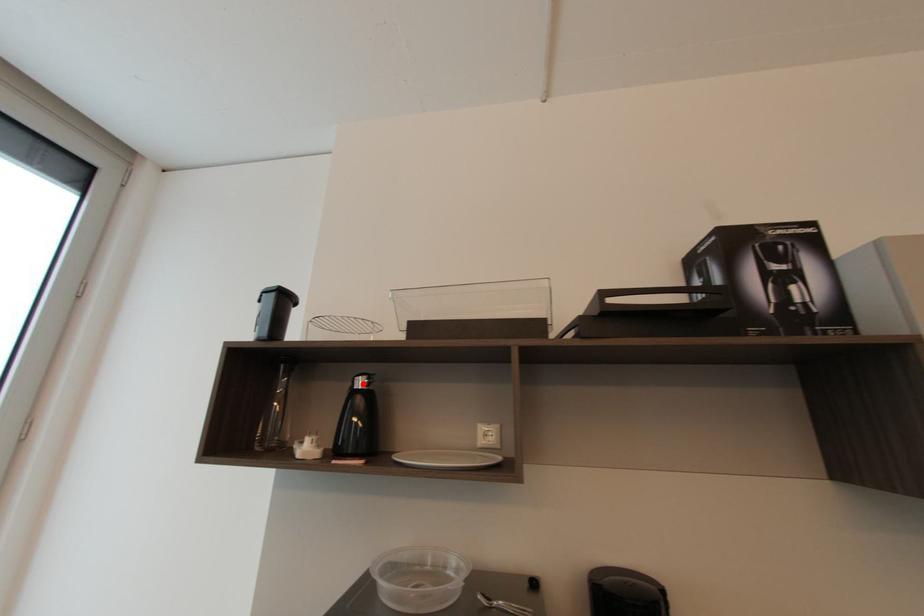
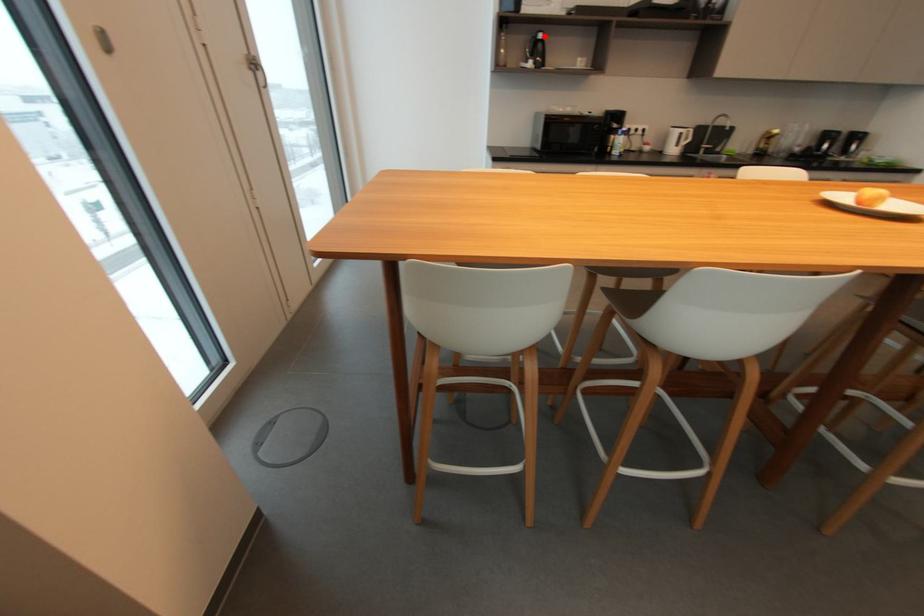
I am providing you with two images of the same scene from different viewpoints. A red point is marked on the first image and another point is marked on the second image. Is the red point in image1 aligned with the point shown in image2?

Yes